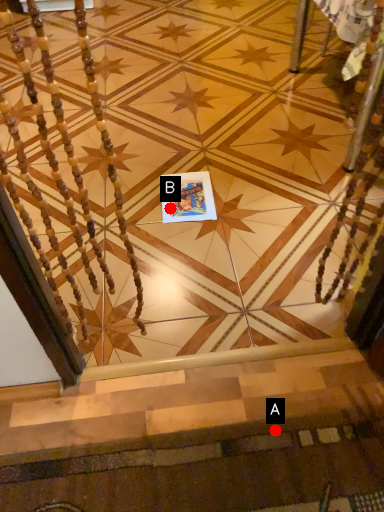
Question: Two points are circled on the image, labeled by A and B beside each circle. Which of the following is the farthest from the observer?

Choices:
 (A) A is further
 (B) B is further

Answer: (B)